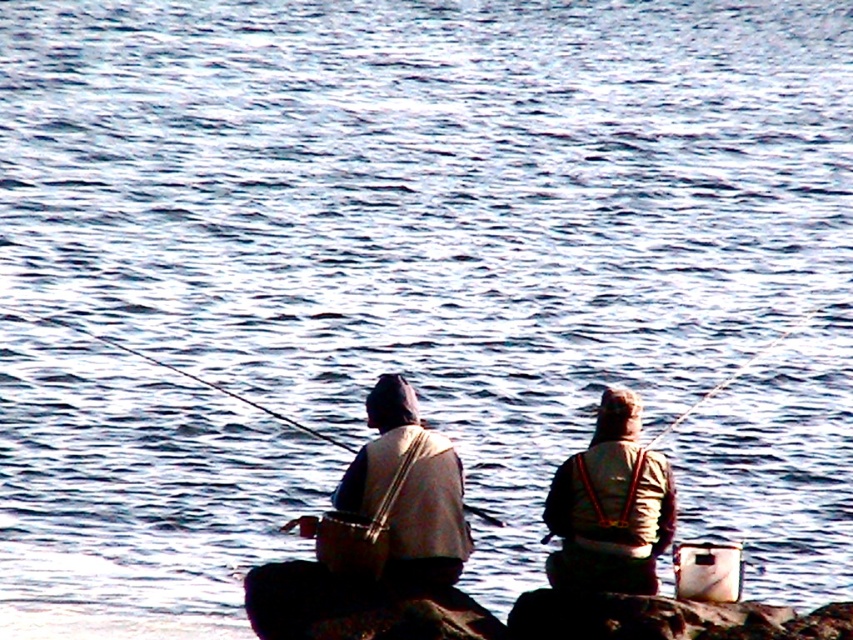
Question: Which of the following is the closest to the observer?

Choices:
 (A) (610, 388)
 (B) (283, 422)
 (C) (590, 580)
 (D) (744, 364)

Answer: (C)

Question: Is tan fabric jacket at center thinner than smooth plastic fishing pole at center?

Choices:
 (A) no
 (B) yes

Answer: (B)

Question: Is camouflage fabric jacket at center closer to the viewer compared to smooth plastic rod at upper right?

Choices:
 (A) no
 (B) yes

Answer: (B)

Question: Based on their relative distances, which object is nearer to the camouflage fabric jacket at center?

Choices:
 (A) tan fabric jacket at center
 (B) smooth plastic rod at upper right
 (C) smooth plastic fishing pole at center

Answer: (A)

Question: Which is farther from the smooth plastic fishing pole at center?

Choices:
 (A) camouflage fabric jacket at center
 (B) tan fabric jacket at center

Answer: (B)

Question: Does camouflage fabric jacket at center have a greater width compared to smooth plastic rod at upper right?

Choices:
 (A) no
 (B) yes

Answer: (A)